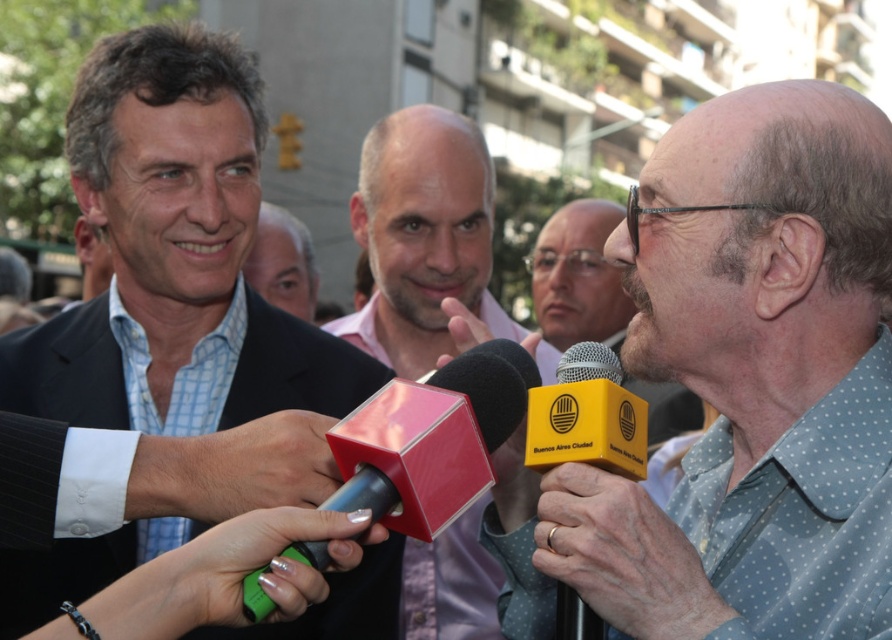
Can you confirm if green plastic microphone at lower left is positioned to the left of yellow matte microphone at center?

Correct, you'll find green plastic microphone at lower left to the left of yellow matte microphone at center.

You are a GUI agent. You are given a task and a screenshot of the screen. Output one action in this format:
    pyautogui.click(x=<x>, y=<y>)
    Task: Click on the green plastic microphone at lower left
    
    Given the screenshot: What is the action you would take?
    pyautogui.click(x=267, y=570)

The width and height of the screenshot is (892, 640). Identify the location of green plastic microphone at lower left. (267, 570).

Can you confirm if gold metallic ring at upper center is positioned to the right of yellow matte microphone at center?

No, gold metallic ring at upper center is not to the right of yellow matte microphone at center.

How much distance is there between gold metallic ring at upper center and yellow matte microphone at center?

gold metallic ring at upper center and yellow matte microphone at center are 6.77 meters apart.

This screenshot has width=892, height=640. I want to click on gold metallic ring at upper center, so click(624, 556).

Which is more to the right, yellow cardboard microphone at center or matte pink shirt at center?

Positioned to the right is yellow cardboard microphone at center.

Who is more forward, (704,464) or (288,284)?

Point (704,464) is in front.

Locate an element on the screen. The width and height of the screenshot is (892, 640). yellow cardboard microphone at center is located at coordinates (752, 380).